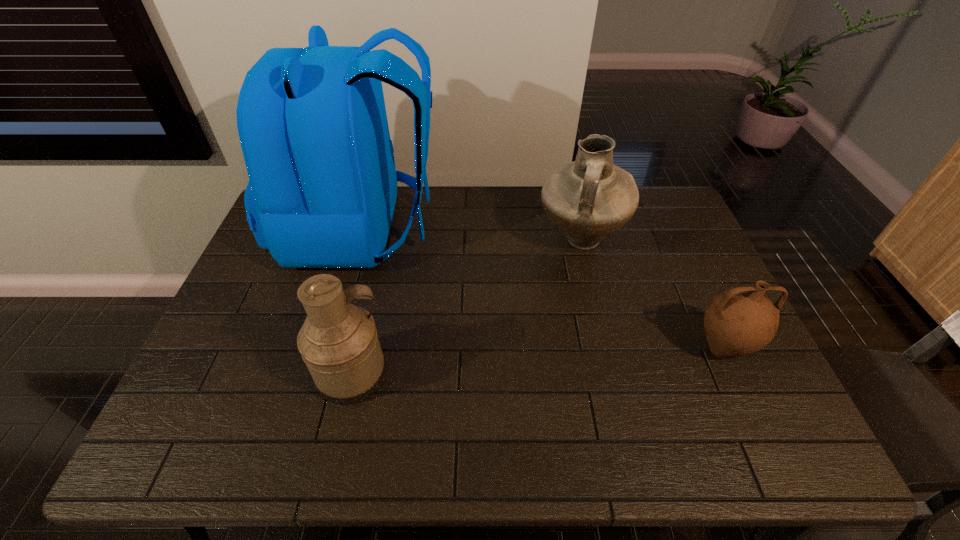
This screenshot has height=540, width=960. Identify the location of free space between the shortest object and the backpack. (542, 289).

You are a GUI agent. You are given a task and a screenshot of the screen. Output one action in this format:
    pyautogui.click(x=<x>, y=<y>)
    Task: Click on the vacant space that is in between the tallest object and the second object from right to left
    The image size is (960, 540).
    Given the screenshot: What is the action you would take?
    pyautogui.click(x=471, y=235)

Locate an element on the screen. This screenshot has height=540, width=960. free space between the leftmost pitcher and the rightmost pitcher is located at coordinates (538, 362).

Locate an element on the screen. The width and height of the screenshot is (960, 540). unoccupied area between the leftmost pitcher and the tallest object is located at coordinates (358, 302).

In order to click on blank region between the rightmost object and the second pitcher from right to left in this screenshot , I will do `click(651, 295)`.

The width and height of the screenshot is (960, 540). I want to click on free spot between the leftmost pitcher and the farthest pitcher, so click(x=467, y=307).

Locate an element on the screen. The image size is (960, 540). vacant space that is in between the second object from right to left and the backpack is located at coordinates (471, 235).

The width and height of the screenshot is (960, 540). In order to click on vacant area that lies between the tallest object and the second pitcher from left to right in this screenshot , I will do `click(471, 235)`.

Identify the location of object that stands as the third closest to the rightmost pitcher. The height and width of the screenshot is (540, 960). (338, 342).

Identify which object is located as the second nearest to the second pitcher from left to right. Please provide its 2D coordinates. Your answer should be formatted as a tuple, i.e. [(x, y)], where the tuple contains the x and y coordinates of a point satisfying the conditions above.

[(312, 123)]